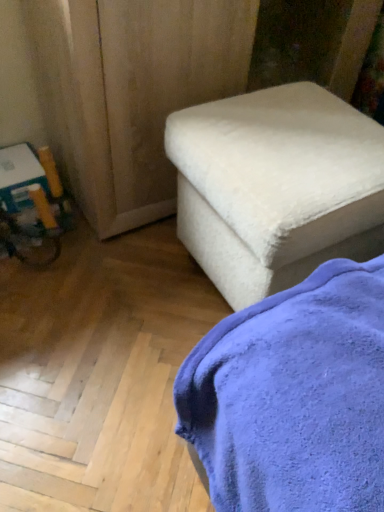
Find the location of a particular element. This screenshot has width=384, height=512. blank space situated above white fuzzy ottoman at center (from a real-world perspective) is located at coordinates (288, 130).